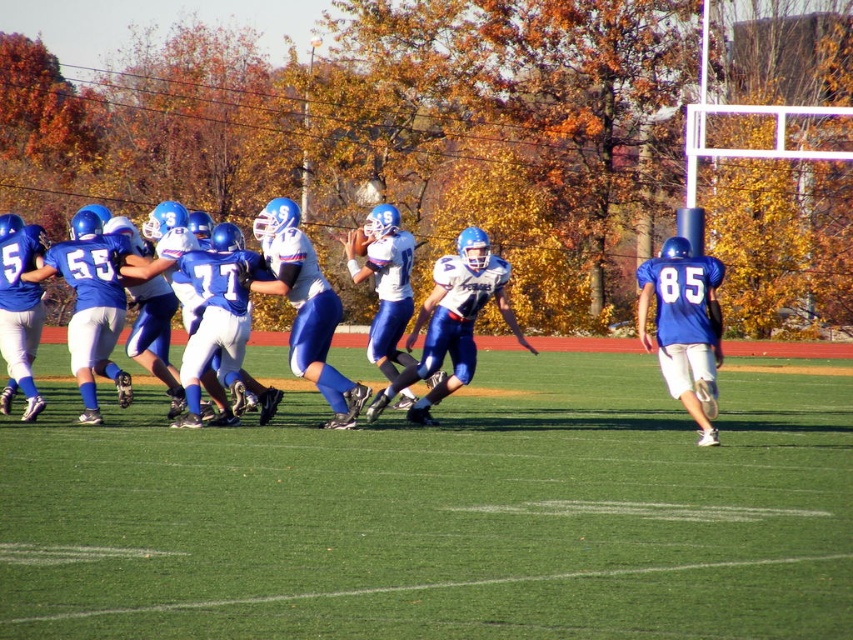
Question: Which object is closer to the camera taking this photo?

Choices:
 (A) matte blue uniform at center
 (B) green grass at center

Answer: (B)

Question: Which point is closer to the camera taking this photo?

Choices:
 (A) (659, 432)
 (B) (241, 282)

Answer: (B)

Question: Does green grass at center appear over matte blue uniform at center?

Choices:
 (A) yes
 (B) no

Answer: (B)

Question: Can you confirm if green grass at center is positioned to the left of matte blue uniform at center?

Choices:
 (A) yes
 (B) no

Answer: (B)

Question: Does green grass at center have a lesser width compared to matte blue uniform at center?

Choices:
 (A) yes
 (B) no

Answer: (B)